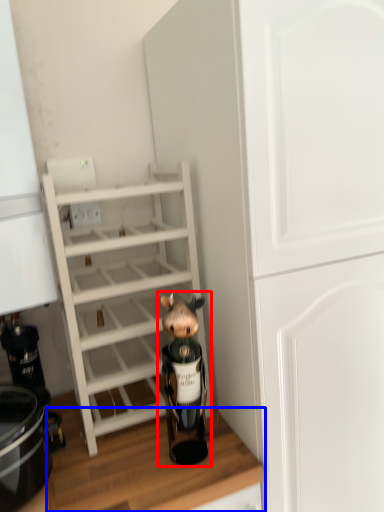
Question: Which of the following is the farthest to the observer, figurine (highlighted by a red box) or counter top (highlighted by a blue box)?

Choices:
 (A) figurine
 (B) counter top

Answer: (A)